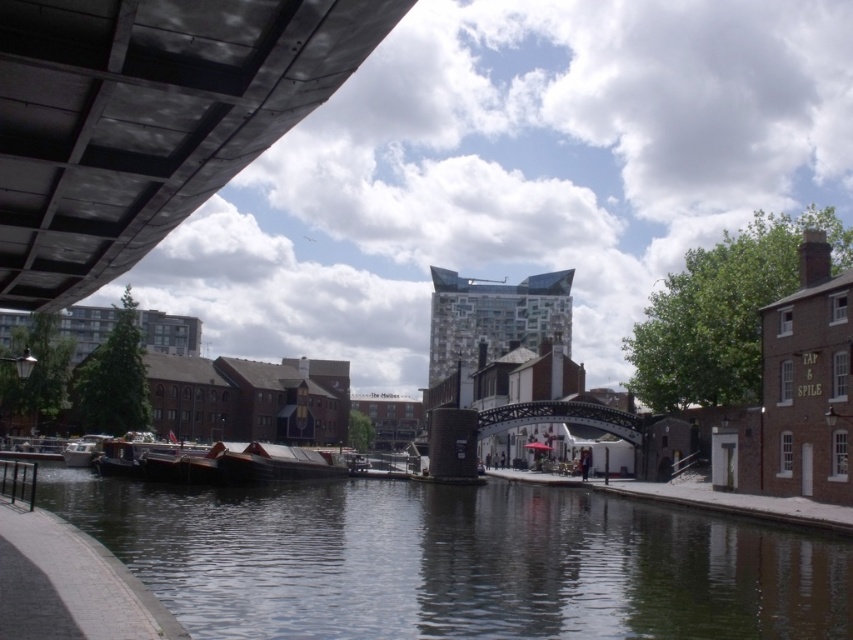
Question: Is dark water at center bigger than wooden boat at center?

Choices:
 (A) no
 (B) yes

Answer: (A)

Question: Which point is farther to the camera?

Choices:
 (A) wooden boat at center
 (B) dark water at center

Answer: (A)

Question: Is dark water at center closer to camera compared to wooden boat at center?

Choices:
 (A) yes
 (B) no

Answer: (A)

Question: Does dark water at center have a greater width compared to wooden boat at center?

Choices:
 (A) no
 (B) yes

Answer: (B)

Question: Among these objects, which one is nearest to the camera?

Choices:
 (A) dark water at center
 (B) wooden boat at center

Answer: (A)

Question: Which point appears closest to the camera in this image?

Choices:
 (A) (527, 524)
 (B) (239, 456)

Answer: (A)